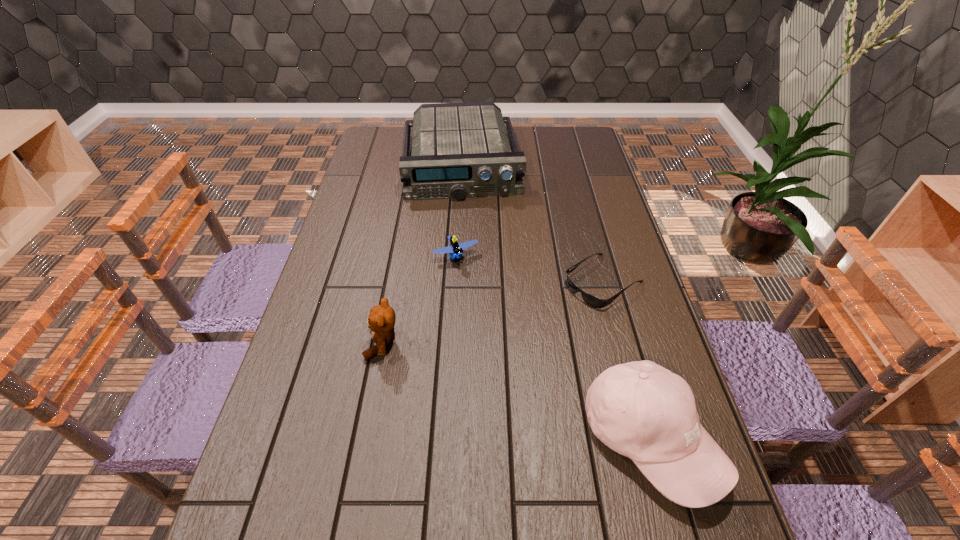
The image size is (960, 540). In order to click on blank region between the second nearest object and the shortest object in this screenshot , I will do `click(493, 312)`.

In order to click on vacant area between the Lego and the shortest object in this screenshot , I will do `click(530, 269)`.

What are the coordinates of `free space between the tallest object and the sunglasses` in the screenshot? It's located at (626, 360).

The width and height of the screenshot is (960, 540). Find the location of `vacant point located between the Lego and the tallest object`. vacant point located between the Lego and the tallest object is located at coordinates (553, 348).

Where is `vacant point located between the Lego and the nearest object`? This screenshot has height=540, width=960. vacant point located between the Lego and the nearest object is located at coordinates (553, 348).

Where is `empty space that is in between the second shortest object and the tallest object`? The image size is (960, 540). empty space that is in between the second shortest object and the tallest object is located at coordinates (553, 348).

The width and height of the screenshot is (960, 540). What are the coordinates of `vacant area that lies between the farthest object and the fourth farthest object` in the screenshot? It's located at (421, 253).

The image size is (960, 540). Find the location of `vacant area that lies between the baseball cap and the second shortest object`. vacant area that lies between the baseball cap and the second shortest object is located at coordinates (553, 348).

Identify the location of free space between the farthest object and the sunglasses. The height and width of the screenshot is (540, 960). (532, 222).

What are the coordinates of `free space between the second shortest object and the tallest object` in the screenshot? It's located at (553, 348).